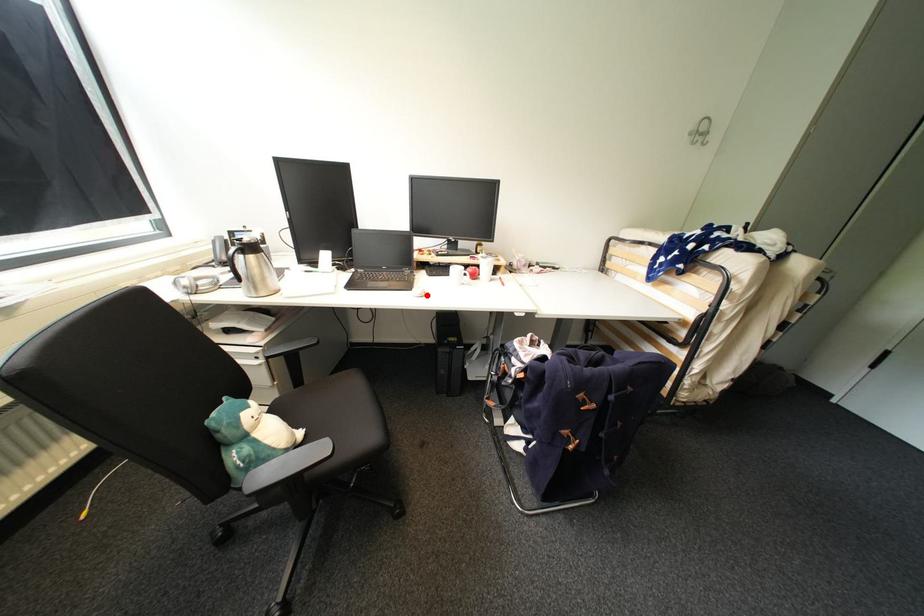
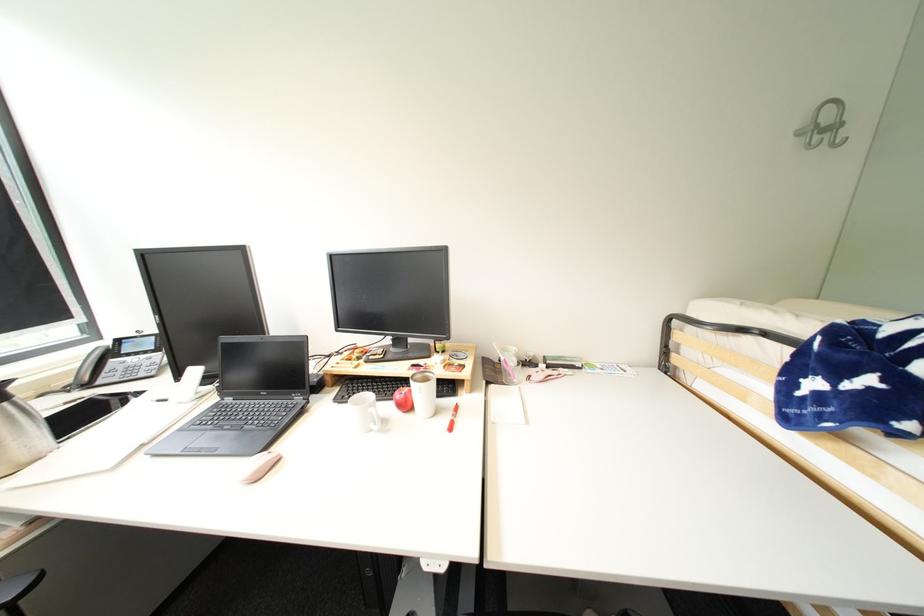
Find the pixel in the second image that matches the highlighted location in the first image.

(254, 480)